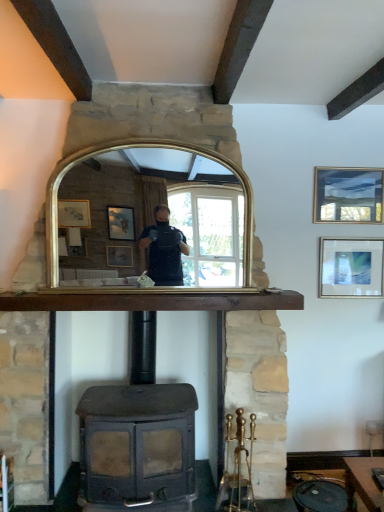
Question: Is matte silver picture frame at upper right, the first picture frame in the bottom-to-top sequence, turned away from matte black wood burning stove at center?

Choices:
 (A) yes
 (B) no

Answer: (B)

Question: From the image's perspective, is matte silver picture frame at upper right, which appears as the second picture frame when viewed from the top, under matte black wood burning stove at center?

Choices:
 (A) no
 (B) yes

Answer: (A)

Question: Is matte silver picture frame at upper right, which appears as the second picture frame when viewed from the top, at the right side of matte black wood burning stove at center?

Choices:
 (A) no
 (B) yes

Answer: (B)

Question: From the image's perspective, is matte silver picture frame at upper right, which appears as the second picture frame when viewed from the top, over matte black wood burning stove at center?

Choices:
 (A) no
 (B) yes

Answer: (B)

Question: From a real-world perspective, does matte silver picture frame at upper right, the first picture frame in the bottom-to-top sequence, stand above matte black wood burning stove at center?

Choices:
 (A) yes
 (B) no

Answer: (A)

Question: Would you say brown wooden mantle at center contains matte black wood burning stove at center?

Choices:
 (A) no
 (B) yes

Answer: (A)

Question: Can you confirm if brown wooden mantle at center is thinner than matte black wood burning stove at center?

Choices:
 (A) yes
 (B) no

Answer: (A)

Question: Does brown wooden mantle at center lie in front of matte black wood burning stove at center?

Choices:
 (A) yes
 (B) no

Answer: (B)

Question: Does brown wooden mantle at center have a lesser height compared to matte black wood burning stove at center?

Choices:
 (A) no
 (B) yes

Answer: (B)

Question: From the image's perspective, is brown wooden mantle at center located beneath matte black wood burning stove at center?

Choices:
 (A) yes
 (B) no

Answer: (B)

Question: Is brown wooden mantle at center to the right of matte black wood burning stove at center from the viewer's perspective?

Choices:
 (A) yes
 (B) no

Answer: (B)

Question: Is brown wooden mantle at center looking in the opposite direction of matte gold picture frame at upper right, which ranks as the 1th picture frame in top-to-bottom order?

Choices:
 (A) yes
 (B) no

Answer: (B)